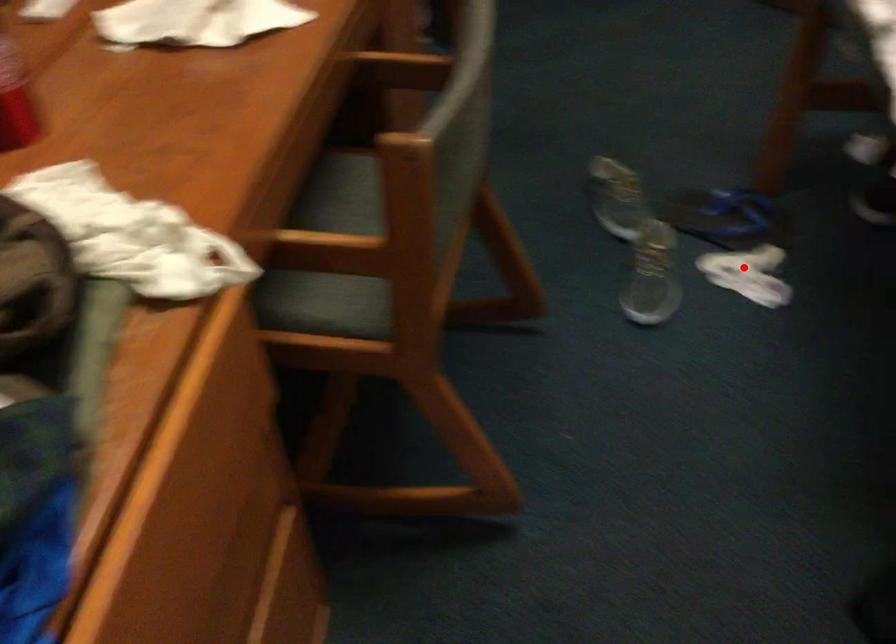
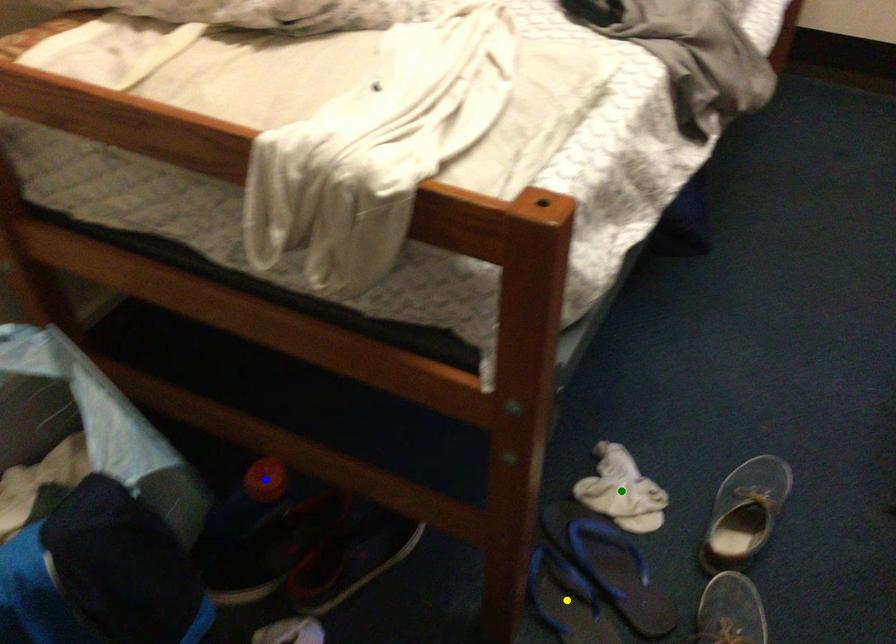
Question: I am providing you with two images of the same scene from different viewpoints. A red point is marked on the first image. You are given multiple points on the second image. In image 2, which mark is for the same physical point as the one in image 1?

Choices:
 (A) green point
 (B) blue point
 (C) yellow point

Answer: (A)